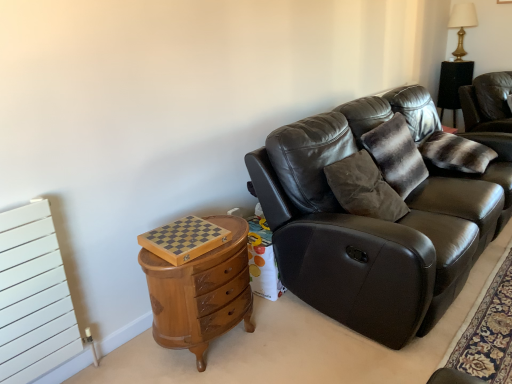
Question: Is leather couch at right aimed at matte black leather couch at center?

Choices:
 (A) no
 (B) yes

Answer: (A)

Question: Does leather couch at right have a greater height compared to matte black leather couch at center?

Choices:
 (A) no
 (B) yes

Answer: (A)

Question: From a real-world perspective, is leather couch at right positioned under matte black leather couch at center based on gravity?

Choices:
 (A) yes
 (B) no

Answer: (B)

Question: Can you confirm if leather couch at right is bigger than matte black leather couch at center?

Choices:
 (A) no
 (B) yes

Answer: (A)

Question: Is leather couch at right facing away from matte black leather couch at center?

Choices:
 (A) yes
 (B) no

Answer: (B)

Question: Looking at the image, does gold metallic table lamp at upper right seem bigger or smaller compared to leather couch at right?

Choices:
 (A) big
 (B) small

Answer: (B)

Question: From a real-world perspective, relative to leather couch at right, is gold metallic table lamp at upper right vertically above or below?

Choices:
 (A) above
 (B) below

Answer: (A)

Question: Would you say gold metallic table lamp at upper right is to the left or to the right of leather couch at right in the picture?

Choices:
 (A) right
 (B) left

Answer: (B)

Question: Is gold metallic table lamp at upper right wider or thinner than leather couch at right?

Choices:
 (A) thin
 (B) wide

Answer: (A)

Question: From the image's perspective, is matte black leather couch at center positioned above or below striped fur pillow at upper right?

Choices:
 (A) below
 (B) above

Answer: (A)

Question: Is point (x=396, y=344) closer or farther from the camera than point (x=443, y=152)?

Choices:
 (A) farther
 (B) closer

Answer: (B)

Question: In terms of size, does matte black leather couch at center appear bigger or smaller than striped fur pillow at upper right?

Choices:
 (A) small
 (B) big

Answer: (B)

Question: Considering the positions of matte black leather couch at center and striped fur pillow at upper right in the image, is matte black leather couch at center wider or thinner than striped fur pillow at upper right?

Choices:
 (A) wide
 (B) thin

Answer: (A)

Question: Looking at their shapes, would you say wooden chest of drawers at left is wider or thinner than striped fur pillow at upper right?

Choices:
 (A) thin
 (B) wide

Answer: (A)

Question: Looking at the image, does wooden chest of drawers at left seem bigger or smaller compared to striped fur pillow at upper right?

Choices:
 (A) small
 (B) big

Answer: (B)